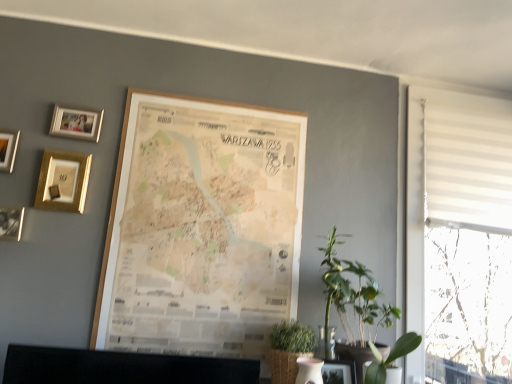
Measure the distance between wooden photo frame at upper left, marked as the first picture frame in a left-to-right arrangement, and camera.

The depth of wooden photo frame at upper left, marked as the first picture frame in a left-to-right arrangement, is 1.47 meters.

Locate an element on the screen. The height and width of the screenshot is (384, 512). green leafy plant at lower center, the second houseplant when ordered from right to left is located at coordinates (289, 349).

Describe the element at coordinates (289, 349) in the screenshot. The width and height of the screenshot is (512, 384). I see `green leafy plant at lower center, the second houseplant when ordered from right to left` at that location.

At what (x,y) coordinates should I click in order to perform the action: click on green leafy plant at lower right, positioned as the 1th plant in right-to-left order. Please return your answer as a coordinate pair (x, y). Looking at the image, I should click on (390, 357).

What do you see at coordinates (332, 280) in the screenshot? I see `green leafy plant at right, the first plant viewed from the left` at bounding box center [332, 280].

The height and width of the screenshot is (384, 512). In order to click on wooden map at center, the fifth picture frame positioned from the left in this screenshot , I will do `click(201, 228)`.

Is green leafy plant at lower right, positioned as the 1th plant in right-to-left order, inside the boundaries of matte black picture frame at lower center, the sixth picture frame in the left-to-right sequence, or outside?

green leafy plant at lower right, positioned as the 1th plant in right-to-left order, is spatially situated outside matte black picture frame at lower center, the sixth picture frame in the left-to-right sequence.

Are green leafy plant at lower right, positioned as the 1th plant in right-to-left order, and matte black picture frame at lower center, the 1th picture frame positioned from the right, located far from each other?

No, there isn't a large distance between green leafy plant at lower right, positioned as the 1th plant in right-to-left order, and matte black picture frame at lower center, the 1th picture frame positioned from the right.

Can you confirm if green leafy plant at lower right, which ranks as the second plant in left-to-right order, is smaller than matte black picture frame at lower center, the 1th picture frame positioned from the right?

No, green leafy plant at lower right, which ranks as the second plant in left-to-right order, is not smaller than matte black picture frame at lower center, the 1th picture frame positioned from the right.

Consider the image. From the image's perspective, which is below, green leafy plant at lower right, positioned as the 1th plant in right-to-left order, or matte black picture frame at lower center, the 1th picture frame positioned from the right?

matte black picture frame at lower center, the 1th picture frame positioned from the right, appears lower in the image.

How different are the orientations of wooden photo frame at upper left, marked as the first picture frame in a left-to-right arrangement, and green leafy plant at lower right, which ranks as the second plant in left-to-right order, in degrees?

2.47 degrees separate the facing orientations of wooden photo frame at upper left, marked as the first picture frame in a left-to-right arrangement, and green leafy plant at lower right, which ranks as the second plant in left-to-right order.

From the picture: In terms of size, does wooden photo frame at upper left, which appears as the sixth picture frame when viewed from the right, appear bigger or smaller than green leafy plant at lower right, positioned as the 1th plant in right-to-left order?

In the image, wooden photo frame at upper left, which appears as the sixth picture frame when viewed from the right, appears to be smaller than green leafy plant at lower right, positioned as the 1th plant in right-to-left order.

I want to click on the 6th picture frame to the left when counting from the green leafy plant at lower right, positioned as the 1th plant in right-to-left order, so [8, 149].

In the scene shown: Is wooden photo frame at upper left, marked as the first picture frame in a left-to-right arrangement, aimed at green leafy plant at lower right, positioned as the 1th plant in right-to-left order?

No, wooden photo frame at upper left, marked as the first picture frame in a left-to-right arrangement, is not turned towards green leafy plant at lower right, positioned as the 1th plant in right-to-left order.

Between green leafy plant at lower right, which ranks as the second plant in left-to-right order, and green leafy plant at right, placed as the 2th plant when sorted from right to left, which one has more height?

With more height is green leafy plant at right, placed as the 2th plant when sorted from right to left.

From the image's perspective, does green leafy plant at lower right, which ranks as the second plant in left-to-right order, appear higher than green leafy plant at right, placed as the 2th plant when sorted from right to left?

No, from the image's perspective, green leafy plant at lower right, which ranks as the second plant in left-to-right order, is not above green leafy plant at right, placed as the 2th plant when sorted from right to left.

Is green leafy plant at lower right, positioned as the 1th plant in right-to-left order, oriented away from green leafy plant at right, placed as the 2th plant when sorted from right to left?

No, green leafy plant at lower right, positioned as the 1th plant in right-to-left order, is not facing away from green leafy plant at right, placed as the 2th plant when sorted from right to left.

In the scene shown: Can you confirm if green leafy plant at lower right, positioned as the 1th plant in right-to-left order, is smaller than green leafy plant at right, the first plant viewed from the left?

Yes, green leafy plant at lower right, positioned as the 1th plant in right-to-left order, is smaller than green leafy plant at right, the first plant viewed from the left.

Based on the photo, between matte black picture frame at lower center, the 1th picture frame positioned from the right, and white textured blinds at right, which one has larger size?

white textured blinds at right.

Is point (323, 382) less distant than point (492, 187)?

That is True.

In the scene shown: Is matte black picture frame at lower center, the 1th picture frame positioned from the right, to the left of white textured blinds at right from the viewer's perspective?

Yes.

Looking at this image, from a real-world perspective, is matte black picture frame at lower center, the sixth picture frame in the left-to-right sequence, located higher than white textured blinds at right?

No.

Can you confirm if white textured blinds at right is bigger than wooden photo frame at upper left, marked as the first picture frame in a left-to-right arrangement?

Yes.

Is white textured blinds at right positioned with its back to wooden photo frame at upper left, marked as the first picture frame in a left-to-right arrangement?

That's not correct — white textured blinds at right is not looking away from wooden photo frame at upper left, marked as the first picture frame in a left-to-right arrangement.

How much distance is there between white textured blinds at right and wooden photo frame at upper left, marked as the first picture frame in a left-to-right arrangement?

white textured blinds at right is 1.66 meters from wooden photo frame at upper left, marked as the first picture frame in a left-to-right arrangement.

In terms of height, does white textured blinds at right look taller or shorter compared to wooden photo frame at upper left, which appears as the sixth picture frame when viewed from the right?

Considering their sizes, white textured blinds at right has more height than wooden photo frame at upper left, which appears as the sixth picture frame when viewed from the right.

From a real-world perspective, which picture frame is the 1st one underneath the matte gold picture frame at upper left, the 4th picture frame when ordered from left to right? Please provide its 2D coordinates.

[(8, 149)]

Which is behind, point (7, 152) or point (52, 130)?

The point (52, 130) is farther.

Who is bigger, wooden photo frame at upper left, marked as the first picture frame in a left-to-right arrangement, or matte gold picture frame at upper left, the 4th picture frame when ordered from left to right?

wooden photo frame at upper left, marked as the first picture frame in a left-to-right arrangement, is bigger.

From the image's perspective, who appears lower, wooden photo frame at upper left, which appears as the sixth picture frame when viewed from the right, or matte gold picture frame at upper left, the third picture frame in the right-to-left sequence?

wooden photo frame at upper left, which appears as the sixth picture frame when viewed from the right, appears lower in the image.

Can you confirm if gold metallic photo frame at upper left, arranged as the 4th picture frame when viewed from the right, is positioned to the left of wooden photo frame at upper left, marked as the first picture frame in a left-to-right arrangement?

In fact, gold metallic photo frame at upper left, arranged as the 4th picture frame when viewed from the right, is to the right of wooden photo frame at upper left, marked as the first picture frame in a left-to-right arrangement.

Between gold metallic photo frame at upper left, arranged as the 4th picture frame when viewed from the right, and wooden photo frame at upper left, marked as the first picture frame in a left-to-right arrangement, which one has smaller width?

wooden photo frame at upper left, marked as the first picture frame in a left-to-right arrangement.

Consider the image. Between gold metallic photo frame at upper left, acting as the 3th picture frame starting from the left, and wooden photo frame at upper left, which appears as the sixth picture frame when viewed from the right, which one has smaller size?

wooden photo frame at upper left, which appears as the sixth picture frame when viewed from the right.

Is the depth of gold metallic photo frame at upper left, acting as the 3th picture frame starting from the left, less than that of wooden photo frame at upper left, marked as the first picture frame in a left-to-right arrangement?

No, the depth of gold metallic photo frame at upper left, acting as the 3th picture frame starting from the left, is greater than that of wooden photo frame at upper left, marked as the first picture frame in a left-to-right arrangement.

Where is `plant that is the 1st object located above the matte black picture frame at lower center, the sixth picture frame in the left-to-right sequence (from the image's perspective)`? The height and width of the screenshot is (384, 512). plant that is the 1st object located above the matte black picture frame at lower center, the sixth picture frame in the left-to-right sequence (from the image's perspective) is located at coordinates (390, 357).

What are the coordinates of `the 4th picture frame behind when counting from the green leafy plant at lower right, positioned as the 1th plant in right-to-left order` in the screenshot? It's located at (8, 149).

Considering their positions, is white textured blinds at right positioned further to green leafy plant at lower center, the second houseplant when ordered from right to left, than wooden map at center, placed as the second picture frame when sorted from right to left?

white textured blinds at right lies further to green leafy plant at lower center, the second houseplant when ordered from right to left, than the other object.

Looking at the image, which one is located closer to green leafy plant at lower right, acting as the second houseplant starting from the left, matte gold picture frame at upper left, the third picture frame in the right-to-left sequence, or matte black picture frame at lower center, the 1th picture frame positioned from the right?

matte black picture frame at lower center, the 1th picture frame positioned from the right, lies closer to green leafy plant at lower right, acting as the second houseplant starting from the left, than the other object.

Estimate the real-world distances between objects in this image. Which object is further from matte gold picture frame at upper left, the 4th picture frame when ordered from left to right, green leafy plant at lower center, the first houseplant viewed from the left, or matte black picture frame at lower center, the 1th picture frame positioned from the right?

matte black picture frame at lower center, the 1th picture frame positioned from the right, is positioned further to the anchor matte gold picture frame at upper left, the 4th picture frame when ordered from left to right.

Which object lies further to the anchor point green leafy plant at lower right, positioned as the 1th plant in right-to-left order, gold metallic photo frame at upper left, acting as the 3th picture frame starting from the left, or matte gold picture frame at upper left, the 4th picture frame when ordered from left to right?

matte gold picture frame at upper left, the 4th picture frame when ordered from left to right.

Estimate the real-world distances between objects in this image. Which object is further from wooden photo frame at upper left, marked as the first picture frame in a left-to-right arrangement, matte gold picture frame at upper left, the third picture frame in the right-to-left sequence, or matte gold picture frame at upper left, which ranks as the 5th picture frame in right-to-left order?

matte gold picture frame at upper left, which ranks as the 5th picture frame in right-to-left order, lies further to wooden photo frame at upper left, marked as the first picture frame in a left-to-right arrangement, than the other object.

Considering their positions, is green leafy plant at lower right, acting as the second houseplant starting from the left, positioned further to gold metallic photo frame at upper left, arranged as the 4th picture frame when viewed from the right, than matte gold picture frame at upper left, which ranks as the 5th picture frame in right-to-left order?

The object further to gold metallic photo frame at upper left, arranged as the 4th picture frame when viewed from the right, is green leafy plant at lower right, acting as the second houseplant starting from the left.

From the image, which object appears to be farther from gold metallic photo frame at upper left, acting as the 3th picture frame starting from the left, green leafy plant at lower right, acting as the second houseplant starting from the left, or green leafy plant at right, the first plant viewed from the left?

green leafy plant at lower right, acting as the second houseplant starting from the left, is positioned further to the anchor gold metallic photo frame at upper left, acting as the 3th picture frame starting from the left.

Based on their spatial positions, is green leafy plant at lower right, acting as the second houseplant starting from the left, or matte gold picture frame at upper left, the third picture frame in the right-to-left sequence, closer to matte gold picture frame at upper left, acting as the 2th picture frame starting from the left?

matte gold picture frame at upper left, the third picture frame in the right-to-left sequence, lies closer to matte gold picture frame at upper left, acting as the 2th picture frame starting from the left, than the other object.

Identify the location of houseplant between green leafy plant at right, placed as the 2th plant when sorted from right to left, and green leafy plant at lower right, positioned as the 1th plant in right-to-left order, in the up-down direction. This screenshot has height=384, width=512. (362, 307).

You are a GUI agent. You are given a task and a screenshot of the screen. Output one action in this format:
    pyautogui.click(x=<x>, y=<y>)
    Task: Click on the houseplant between matte black picture frame at lower center, the 1th picture frame positioned from the right, and white textured blinds at right from left to right
    The width and height of the screenshot is (512, 384).
    Given the screenshot: What is the action you would take?
    pyautogui.click(x=362, y=307)

This screenshot has width=512, height=384. Identify the location of houseplant between matte gold picture frame at upper left, the third picture frame in the right-to-left sequence, and matte black picture frame at lower center, the 1th picture frame positioned from the right, in the horizontal direction. (289, 349).

This screenshot has width=512, height=384. Identify the location of houseplant between green leafy plant at lower center, the second houseplant when ordered from right to left, and white textured blinds at right from left to right. (362, 307).